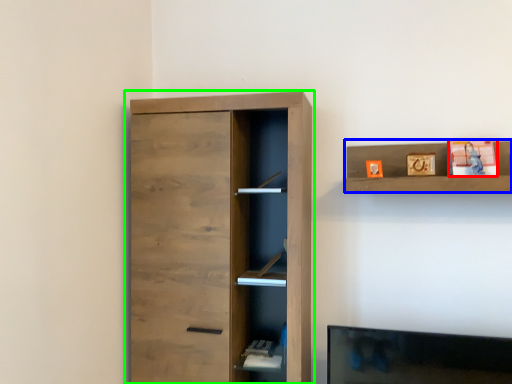
Question: Considering the real-world distances, which object is farthest from toy (highlighted by a red box)? shelf (highlighted by a blue box) or cupboard (highlighted by a green box)?

Choices:
 (A) shelf
 (B) cupboard

Answer: (B)